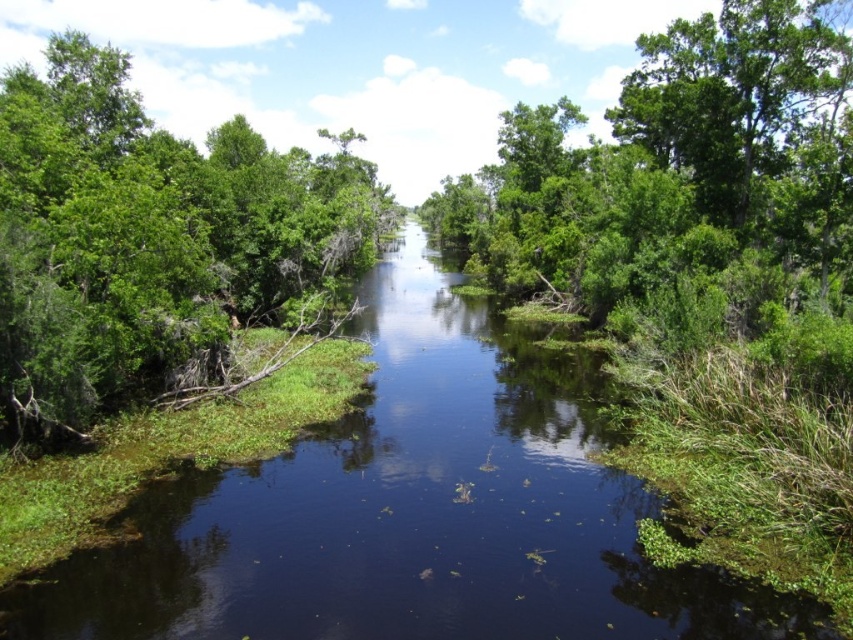
Which of these two, green leafy tree at left or green leafy tree at upper right, stands taller?

green leafy tree at left

This screenshot has width=853, height=640. Find the location of `green leafy tree at left`. green leafy tree at left is located at coordinates (148, 241).

Is green leafy stream at center wider than green leafy tree at upper right?

Yes, green leafy stream at center is wider than green leafy tree at upper right.

Between point (482, 486) and point (793, 132), which one is positioned behind?

The point (793, 132) is behind.

You are a GUI agent. You are given a task and a screenshot of the screen. Output one action in this format:
    pyautogui.click(x=<x>, y=<y>)
    Task: Click on the green leafy stream at center
    
    Given the screenshot: What is the action you would take?
    pyautogui.click(x=410, y=513)

Which is behind, point (567, 621) or point (83, 42)?

The point (83, 42) is behind.

Can you confirm if green leafy stream at center is positioned below green leafy tree at left?

Yes.

Is point (535, 401) less distant than point (77, 109)?

That is True.

At what (x,y) coordinates should I click in order to perform the action: click on green leafy stream at center. Please return your answer as a coordinate pair (x, y). Looking at the image, I should click on (410, 513).